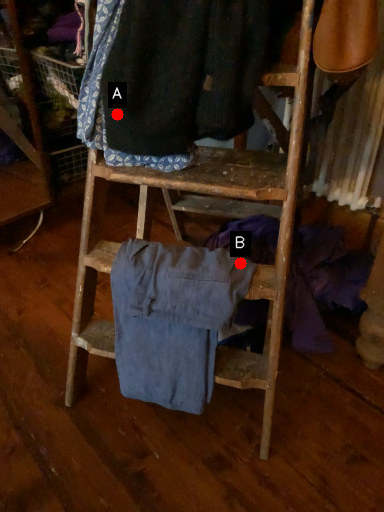
Question: Two points are circled on the image, labeled by A and B beside each circle. Among these points, which one is farthest from the camera?

Choices:
 (A) A is further
 (B) B is further

Answer: (B)